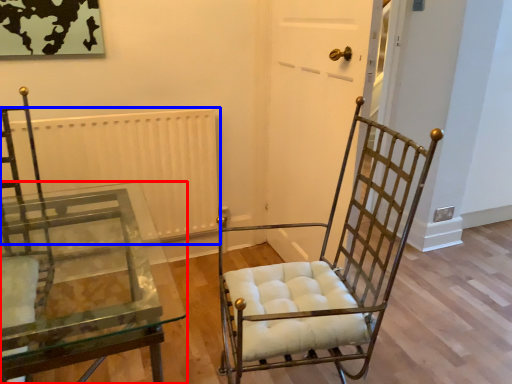
Question: Which point is further to the camera, table (highlighted by a red box) or radiator (highlighted by a blue box)?

Choices:
 (A) table
 (B) radiator

Answer: (B)